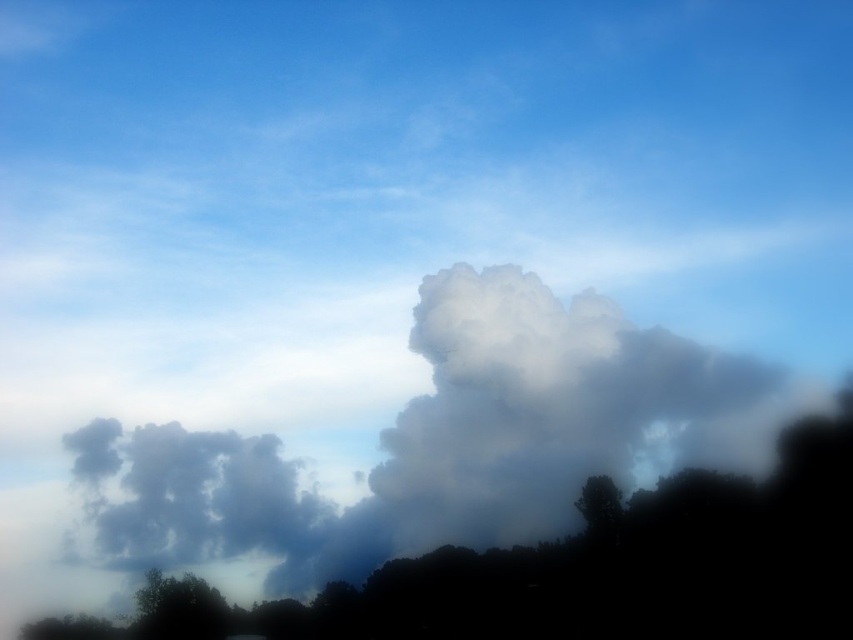
Between green leafy tree at lower left and green matte tree at lower right, which one has more height?

green leafy tree at lower left is taller.

Looking at this image, can you confirm if green leafy tree at lower left is bigger than green matte tree at lower right?

Yes.

The height and width of the screenshot is (640, 853). Identify the location of green leafy tree at lower left. (178, 609).

At what (x,y) coordinates should I click in order to perform the action: click on green leafy tree at lower left. Please return your answer as a coordinate pair (x, y). Looking at the image, I should click on point(178,609).

Between white fluffy cloud at center and green leafy tree at lower left, which one appears on the left side from the viewer's perspective?

green leafy tree at lower left is more to the left.

Between point (409, 460) and point (199, 589), which one is positioned in front?

Point (199, 589) is in front.

This screenshot has height=640, width=853. In order to click on white fluffy cloud at center in this screenshot , I will do (x=448, y=442).

Who is more forward, (647, 476) or (596, 488)?

Point (596, 488) is in front.

Does white fluffy cloud at center appear over green matte tree at lower right?

No, white fluffy cloud at center is not above green matte tree at lower right.

This screenshot has height=640, width=853. What do you see at coordinates (448, 442) in the screenshot?
I see `white fluffy cloud at center` at bounding box center [448, 442].

Locate an element on the screen. The image size is (853, 640). white fluffy cloud at center is located at coordinates [448, 442].